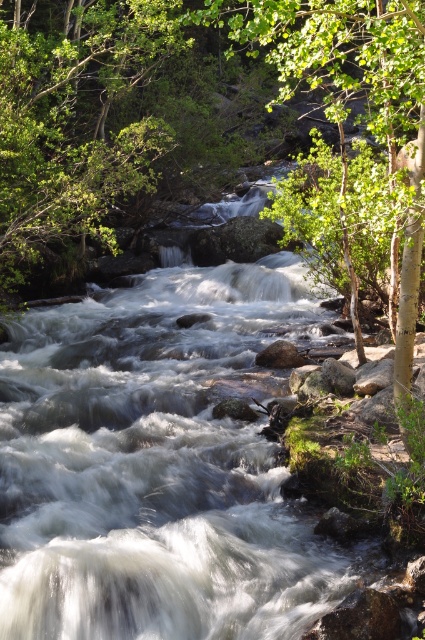
Does green leafy tree at upper left come in front of green leafy tree at center?

No, it is not.

This screenshot has width=425, height=640. What do you see at coordinates (74, 122) in the screenshot? I see `green leafy tree at upper left` at bounding box center [74, 122].

Does point (56, 193) lie behind point (303, 20)?

No, (56, 193) is in front of (303, 20).

Locate an element on the screen. The height and width of the screenshot is (640, 425). green leafy tree at upper left is located at coordinates (74, 122).